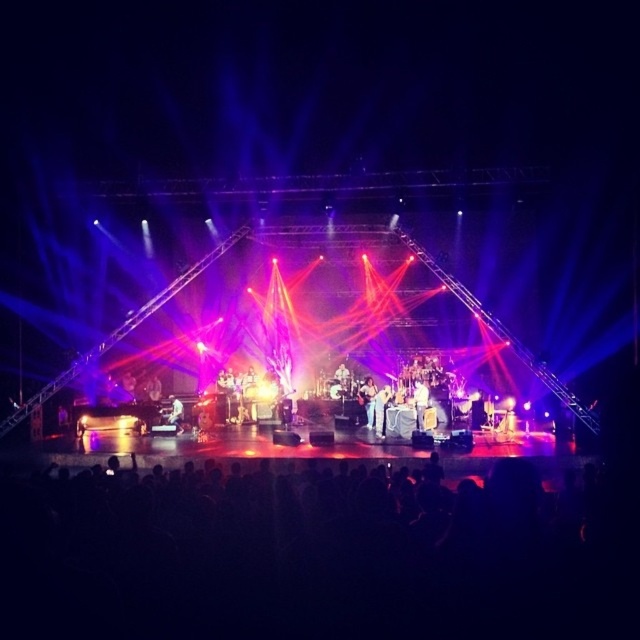
You are a photographer at the concert and want to capture a clear shot of the white fabric shirt at center and denim pants at center. Since the lighting is intense, you need to adjust your camera settings. Which object should you focus on first to ensure both are in focus?

The white fabric shirt at center is behind denim pants at center, so you should focus on the white fabric shirt at center first to ensure both are in focus.

You are a photographer at the concert and want to capture a closeup shot of the performer. Since the denim pants at center and white fabric shirt at center are both in the frame, which clothing item would you focus on to ensure the entire subject fits within the camera frame? Explain your reasoning based on their sizes.

The denim pants at center have a smaller width than the white fabric shirt at center. To ensure the entire subject fits within the camera frame, you should focus on the denim pants at center since it is narrower, allowing the wider white fabric shirt at center to still be captured without cropping.